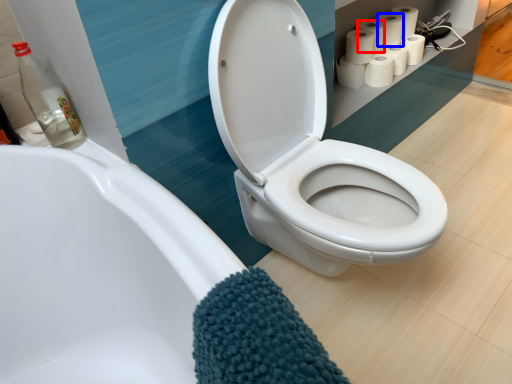
Question: Which object appears farthest to the camera in this image, toilet paper (highlighted by a red box) or toilet paper (highlighted by a blue box)?

Choices:
 (A) toilet paper
 (B) toilet paper

Answer: (B)